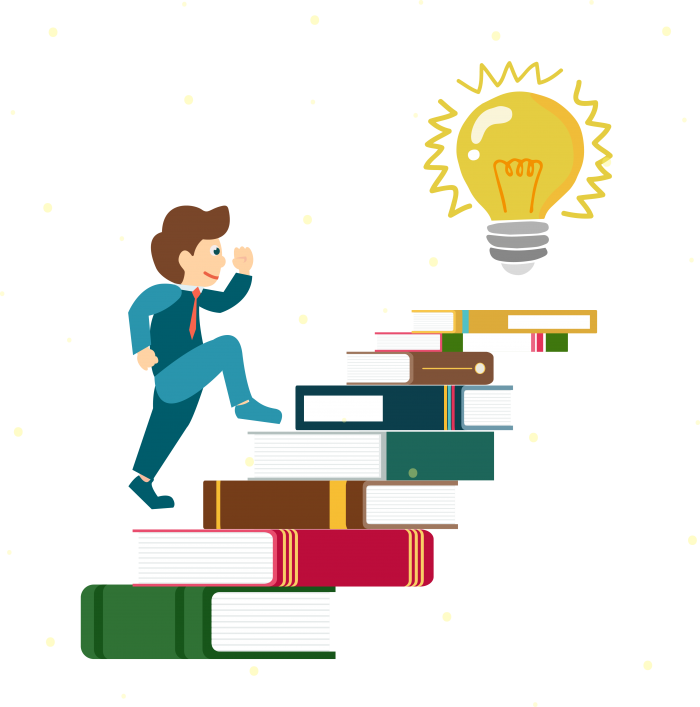
Locate an element on the screen. This screenshot has width=700, height=707. books is located at coordinates (171, 617), (330, 559), (288, 508), (425, 448), (411, 399), (453, 367), (452, 343), (496, 322).